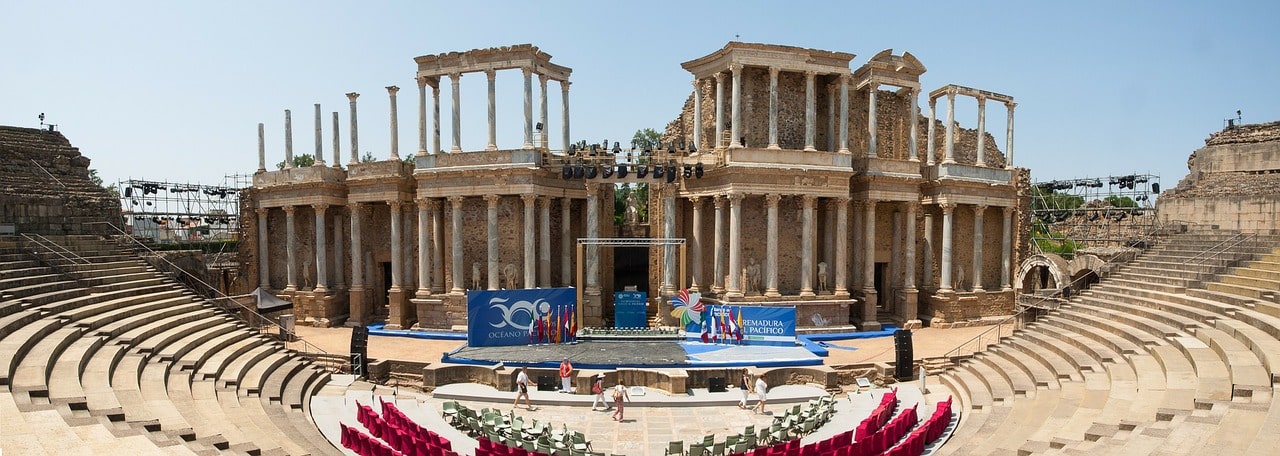
Find the location of a particular element. doorway is located at coordinates 877,272, 379,273.